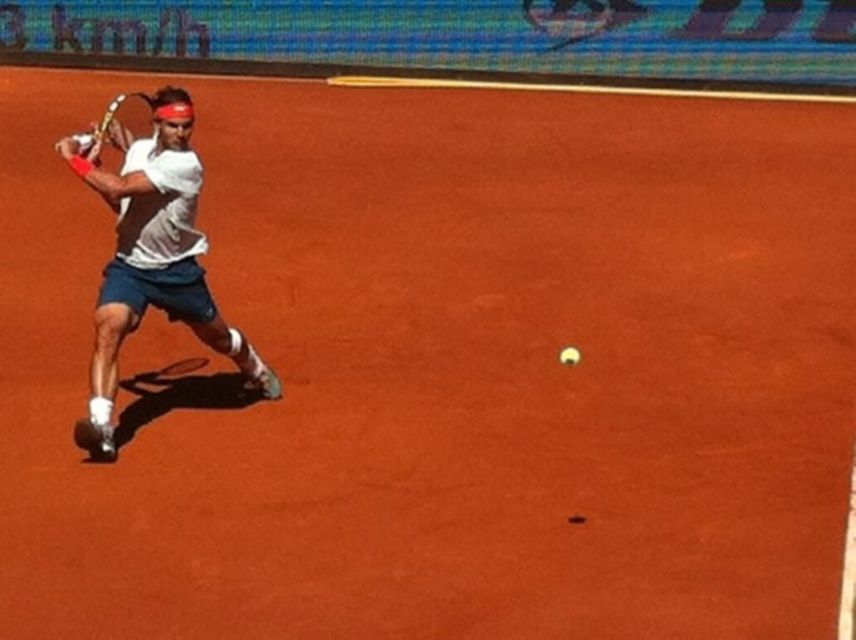
Which is more to the right, metallic gold tennis racket at left or yellow matte tennis ball at center?

Positioned to the right is yellow matte tennis ball at center.

Can you confirm if metallic gold tennis racket at left is bigger than yellow matte tennis ball at center?

Correct, metallic gold tennis racket at left is larger in size than yellow matte tennis ball at center.

Where is `metallic gold tennis racket at left`? metallic gold tennis racket at left is located at coordinates (107, 120).

You are a GUI agent. You are given a task and a screenshot of the screen. Output one action in this format:
    pyautogui.click(x=<x>, y=<y>)
    Task: Click on the metallic gold tennis racket at left
    The image size is (856, 640).
    Given the screenshot: What is the action you would take?
    pyautogui.click(x=107, y=120)

Does white cotton shirt at left have a lesser width compared to yellow matte tennis ball at center?

In fact, white cotton shirt at left might be wider than yellow matte tennis ball at center.

Is white cotton shirt at left bigger than yellow matte tennis ball at center?

Indeed, white cotton shirt at left has a larger size compared to yellow matte tennis ball at center.

Who is more forward, (x=94, y=401) or (x=566, y=356)?

Point (x=566, y=356) is in front.

The image size is (856, 640). In order to click on white cotton shirt at left in this screenshot , I will do `click(152, 257)`.

Does white cotton shirt at left appear on the right side of metallic gold tennis racket at left?

Correct, you'll find white cotton shirt at left to the right of metallic gold tennis racket at left.

Locate an element on the screen. This screenshot has height=640, width=856. white cotton shirt at left is located at coordinates (152, 257).